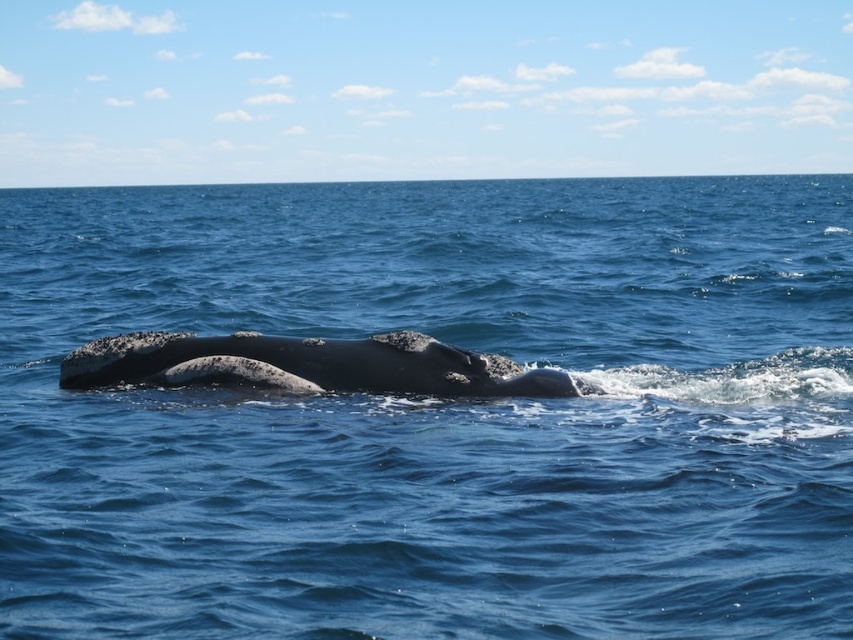
Which of these two, glossy blue water at center or smooth gray whale at center, stands taller?

glossy blue water at center

This screenshot has height=640, width=853. Find the location of `glossy blue water at center`. glossy blue water at center is located at coordinates (437, 413).